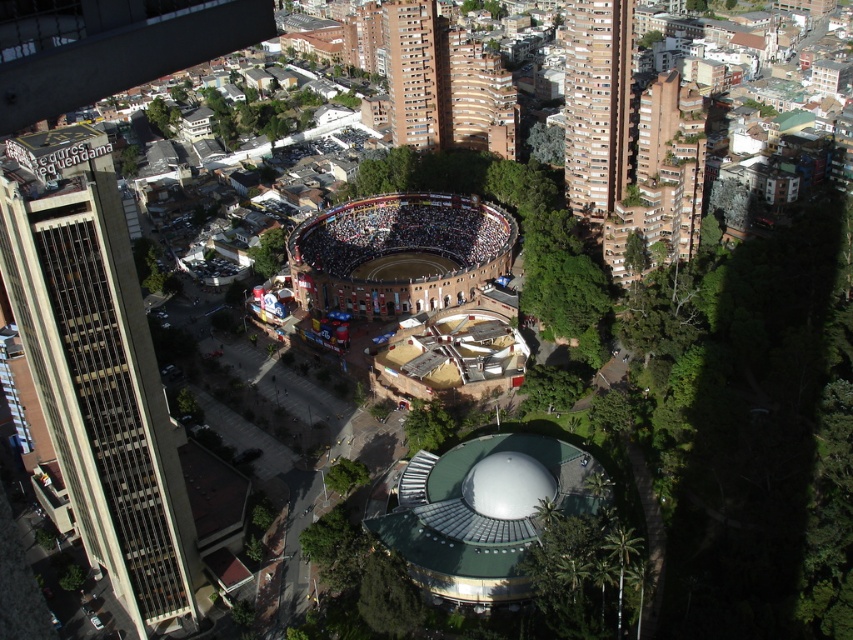
You are a drone operator trying to capture aerial footage of the beige concrete tower at left and the brown brick arena at center. From your current position, which structure is closer to the ground?

The beige concrete tower at left is positioned under brown brick arena at center, so the beige concrete tower at left is closer to the ground.

You are a drone operator trying to capture aerial footage of the brown brick building at upper right and the brown brick arena at center. From your current position above the arena, which building will appear closer to the camera?

The brown brick building at upper right will appear closer to the camera because it is in front of the brown brick arena at center.